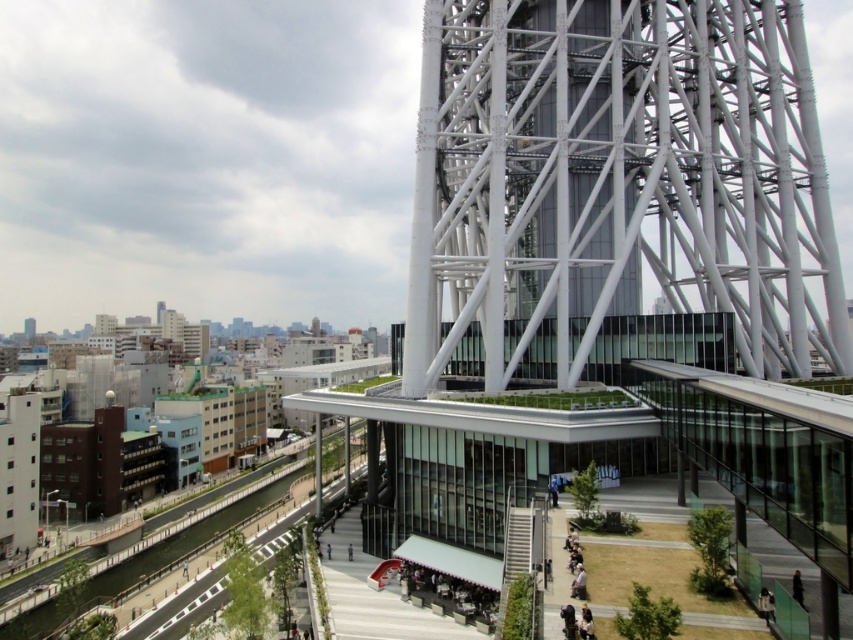
You are standing at the base of the white metallic tower at center and want to take a photo of it. There is a black fabric person at lower right nearby. To ensure the tower fills most of your camera frame, should you move closer to or farther away from the tower?

Since the white metallic tower at center is wider than the black fabric person at lower right, moving closer to the tower will make it fill more of the camera frame, while the person will appear smaller in comparison. Therefore, move closer to the tower to achieve the desired effect.

You are a photographer planning to capture the entire white metallic tower at center and the dark gray fabric jacket at lower center in a single frame. Given that your camera can only focus on objects within a 200 cm height range, will both objects fit vertically in your shot?

The white metallic tower at center is larger in size than the dark gray fabric jacket at lower center, so the height difference between them might exceed the 200 cm range. However, without exact measurements, it is uncertain if both will fit. Adjust your camera angle or position to ensure both are within the frame.